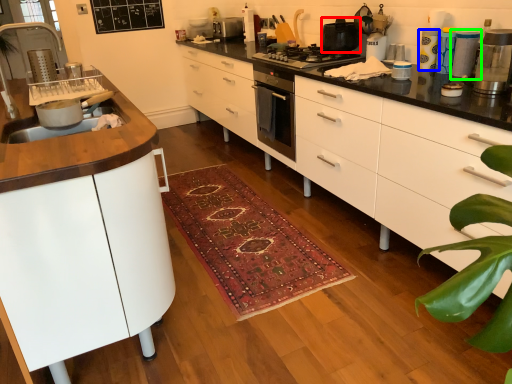
Question: Which object is positioned closest to kitchen appliance (highlighted by a red box)? Select from appliance (highlighted by a blue box) and appliance (highlighted by a green box).

Choices:
 (A) appliance
 (B) appliance

Answer: (A)